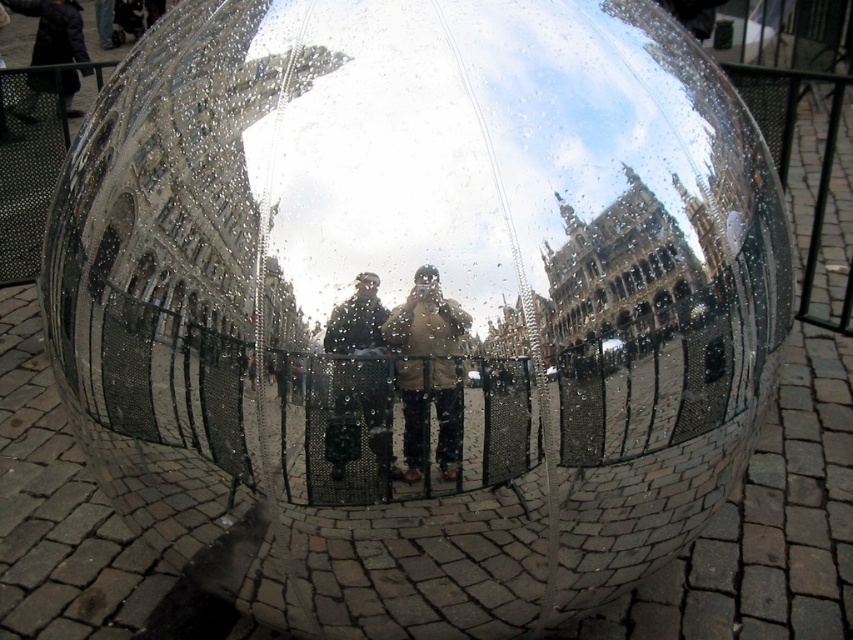
Question: Which is nearer to the dark gray fabric jacket at center?

Choices:
 (A) dark blue jacket at upper left
 (B) brown leather jacket at center

Answer: (B)

Question: Which object is closer to the camera taking this photo?

Choices:
 (A) dark blue jacket at upper left
 (B) brown leather jacket at center
 (C) dark gray fabric jacket at center

Answer: (B)

Question: Is brown leather jacket at center wider than dark blue jacket at upper left?

Choices:
 (A) yes
 (B) no

Answer: (B)

Question: Which point is farther from the camera taking this photo?

Choices:
 (A) (374, 314)
 (B) (39, 20)
 (C) (410, 387)

Answer: (B)

Question: Can you confirm if brown leather jacket at center is thinner than dark blue jacket at upper left?

Choices:
 (A) no
 (B) yes

Answer: (B)

Question: Is the position of brown leather jacket at center more distant than that of dark gray fabric jacket at center?

Choices:
 (A) no
 (B) yes

Answer: (A)